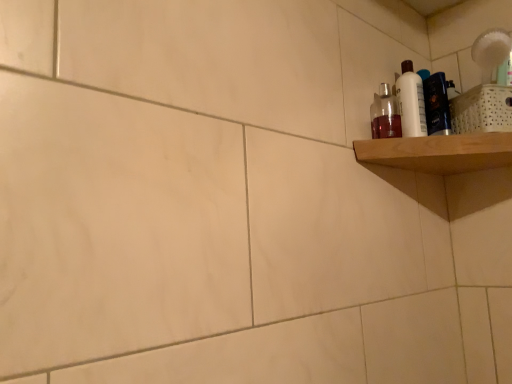
Question: From a real-world perspective, is white glossy bottle at upper right physically below translucent plastic bottle at upper right?

Choices:
 (A) no
 (B) yes

Answer: (A)

Question: Is white glossy bottle at upper right wider than translucent plastic bottle at upper right?

Choices:
 (A) no
 (B) yes

Answer: (A)

Question: Is white glossy bottle at upper right touching translucent plastic bottle at upper right?

Choices:
 (A) no
 (B) yes

Answer: (B)

Question: Are white glossy bottle at upper right and translucent plastic bottle at upper right located far from each other?

Choices:
 (A) yes
 (B) no

Answer: (B)

Question: Is white glossy bottle at upper right aimed at translucent plastic bottle at upper right?

Choices:
 (A) no
 (B) yes

Answer: (A)

Question: From the image's perspective, relative to white glossy bottle at upper right, is wooden shelf at upper right above or below?

Choices:
 (A) below
 (B) above

Answer: (A)

Question: Is wooden shelf at upper right in front of or behind white glossy bottle at upper right in the image?

Choices:
 (A) front
 (B) behind

Answer: (A)

Question: Does point (362, 142) appear closer or farther from the camera than point (415, 114)?

Choices:
 (A) farther
 (B) closer

Answer: (B)

Question: In terms of height, does wooden shelf at upper right look taller or shorter compared to white glossy bottle at upper right?

Choices:
 (A) short
 (B) tall

Answer: (A)

Question: Do you think wooden shelf at upper right is within translucent plastic bottle at upper right, or outside of it?

Choices:
 (A) outside
 (B) inside

Answer: (A)

Question: From the image's perspective, is wooden shelf at upper right located above or below translucent plastic bottle at upper right?

Choices:
 (A) above
 (B) below

Answer: (B)

Question: Considering the positions of wooden shelf at upper right and translucent plastic bottle at upper right in the image, is wooden shelf at upper right bigger or smaller than translucent plastic bottle at upper right?

Choices:
 (A) small
 (B) big

Answer: (B)

Question: Is point (410, 155) positioned closer to the camera than point (397, 114)?

Choices:
 (A) closer
 (B) farther

Answer: (A)

Question: In the image, is translucent plastic bottle at upper right positioned in front of or behind white glossy bottle at upper right?

Choices:
 (A) front
 (B) behind

Answer: (A)

Question: Is translucent plastic bottle at upper right inside or outside of white glossy bottle at upper right?

Choices:
 (A) inside
 (B) outside

Answer: (B)